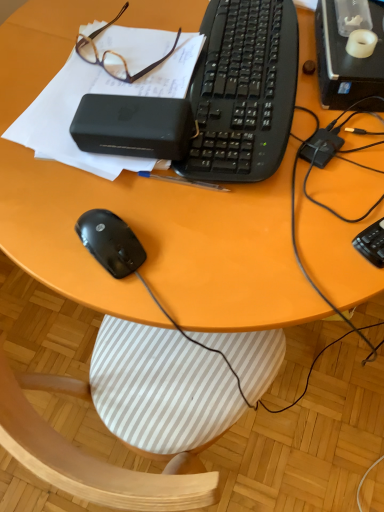
Locate an element on the screen. The height and width of the screenshot is (512, 384). vacant space to the left of black plastic keyboard at right, the 1th computer keyboard viewed from the front is located at coordinates (298, 230).